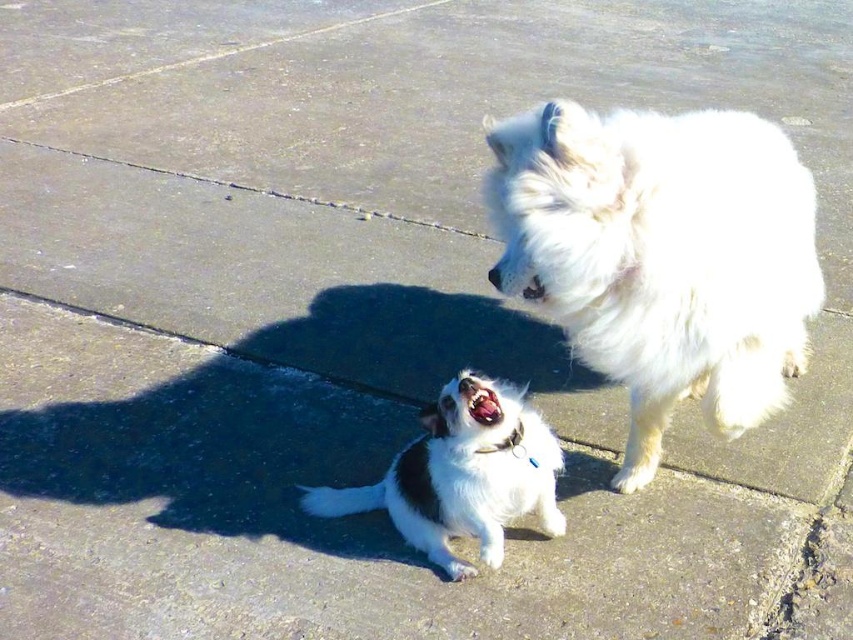
Can you confirm if white fluffy dog at upper right is positioned to the right of white fur dog at center?

Correct, you'll find white fluffy dog at upper right to the right of white fur dog at center.

Which is in front, point (596, 259) or point (514, 413)?

Point (596, 259) is in front.

Is point (778, 172) less distant than point (450, 440)?

No, (778, 172) is behind (450, 440).

The image size is (853, 640). What are the coordinates of `white fluffy dog at upper right` in the screenshot? It's located at (662, 257).